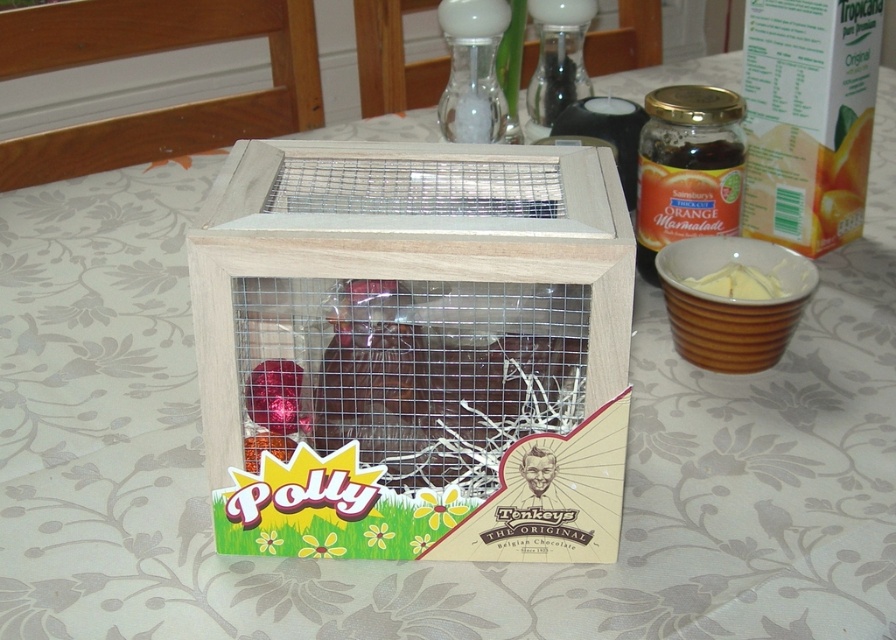
Question: Considering the relative positions of wooden wire mesh bird cage at center and yellow creamy butter at center in the image provided, where is wooden wire mesh bird cage at center located with respect to yellow creamy butter at center?

Choices:
 (A) above
 (B) below

Answer: (B)

Question: Is shiny chocolate bar at center below yellow creamy butter at center?

Choices:
 (A) yes
 (B) no

Answer: (A)

Question: Which of the following is the closest to the observer?

Choices:
 (A) shiny chocolate bar at center
 (B) wooden wire mesh bird cage at center

Answer: (B)

Question: Is shiny chocolate bar at center above yellow creamy butter at center?

Choices:
 (A) yes
 (B) no

Answer: (B)

Question: Based on their relative distances, which object is farther from the yellow creamy butter at center?

Choices:
 (A) shiny chocolate bar at center
 (B) wooden wire mesh bird cage at center

Answer: (B)

Question: Which point appears closest to the camera in this image?

Choices:
 (A) (467, 269)
 (B) (515, 337)
 (C) (694, 284)

Answer: (A)